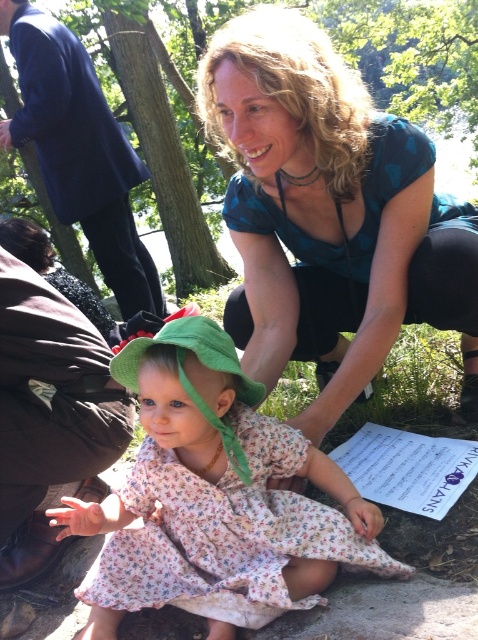
Locate an element on the screen. blue printed dress at center is located at coordinates (329, 216).

This screenshot has height=640, width=478. I want to click on blue printed dress at center, so click(x=329, y=216).

Is blue printed dress at center smaller than dark blue fabric at upper left?

Yes.

Can you confirm if blue printed dress at center is bigger than dark blue fabric at upper left?

Actually, blue printed dress at center might be smaller than dark blue fabric at upper left.

Who is more distant from viewer, (243, 282) or (35, 99)?

The point (35, 99) is more distant.

At what (x,y) coordinates should I click in order to perform the action: click on blue printed dress at center. Please return your answer as a coordinate pair (x, y). The height and width of the screenshot is (640, 478). Looking at the image, I should click on (329, 216).

Is floral cotton dress at center thinner than dark blue fabric at upper left?

Yes.

Which is in front, point (325, 541) or point (21, 129)?

Point (325, 541) is in front.

Is point (354, 560) behind point (66, 179)?

No, (354, 560) is in front of (66, 179).

This screenshot has height=640, width=478. I want to click on floral cotton dress at center, so click(224, 532).